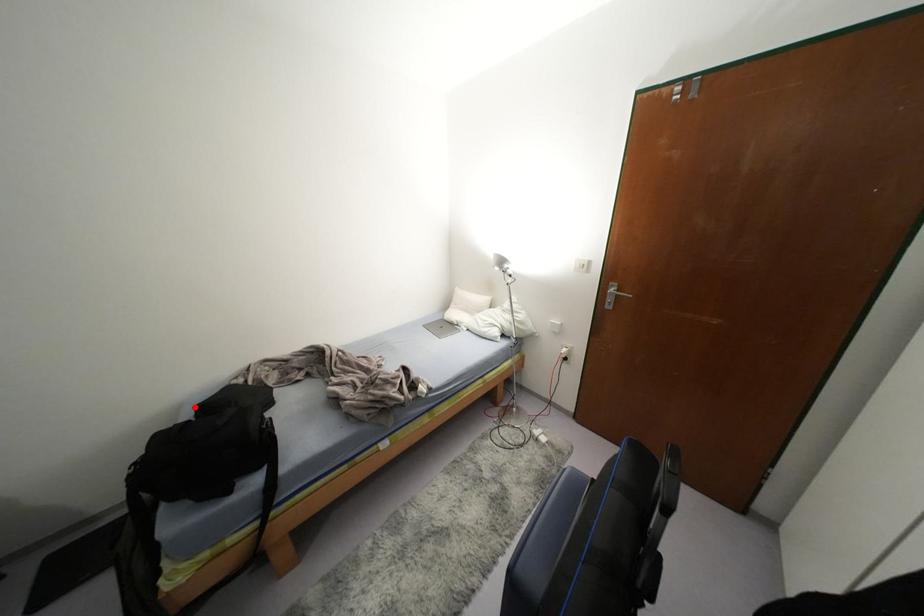
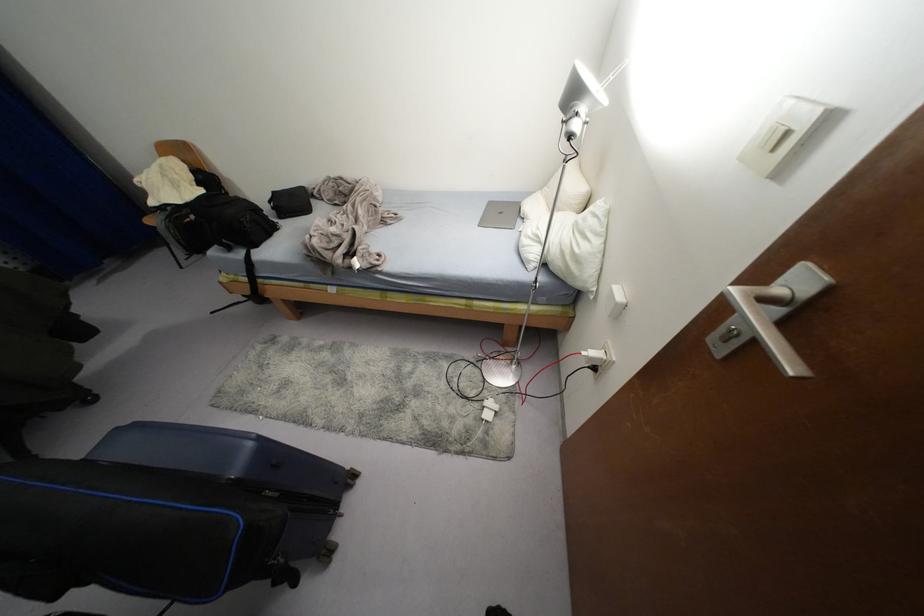
Where in the second image is the point corresponding to the highlighted location from the first image?

(274, 192)